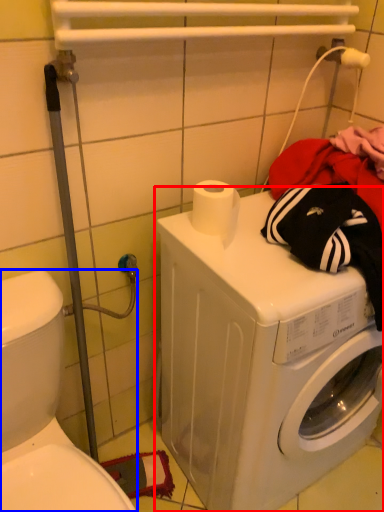
Question: Among these objects, which one is farthest to the camera, washing machine (highlighted by a red box) or washer (highlighted by a blue box)?

Choices:
 (A) washing machine
 (B) washer

Answer: (A)